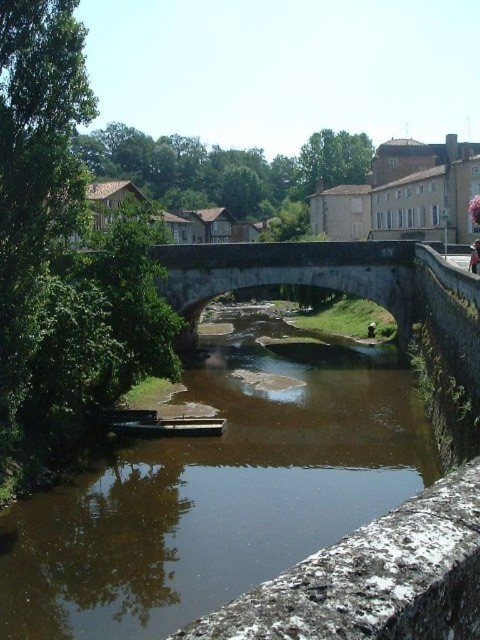
Is brown stone river at center positioned in front of light pink fabric at center?

Yes, it is.

The height and width of the screenshot is (640, 480). What do you see at coordinates (214, 497) in the screenshot? I see `brown stone river at center` at bounding box center [214, 497].

Describe the element at coordinates (214, 497) in the screenshot. I see `brown stone river at center` at that location.

Locate an element on the screen. The height and width of the screenshot is (640, 480). brown stone river at center is located at coordinates (214, 497).